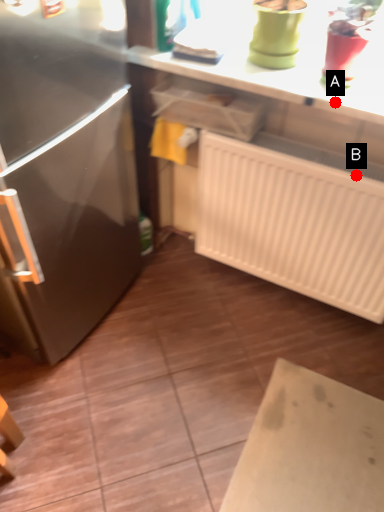
Question: Two points are circled on the image, labeled by A and B beside each circle. Among these points, which one is farthest from the camera?

Choices:
 (A) A is further
 (B) B is further

Answer: (B)